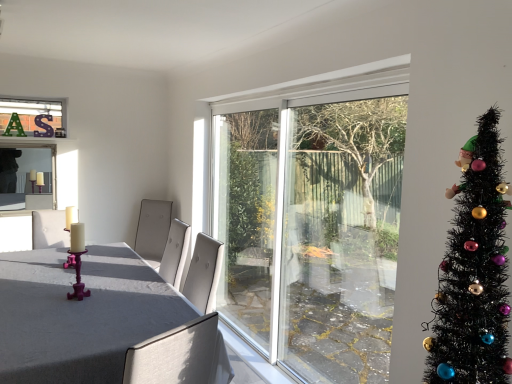
Locate an element on the screen. Image resolution: width=512 pixels, height=384 pixels. space that is in front of purple metallic candle holder at left is located at coordinates (65, 308).